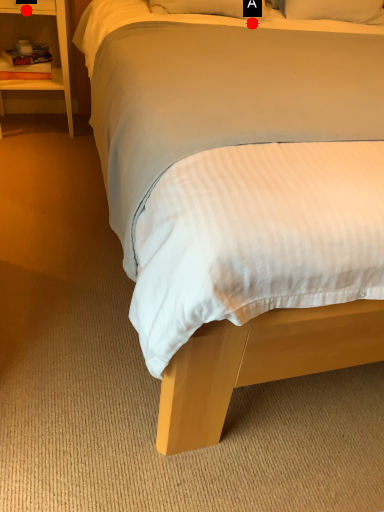
Question: Two points are circled on the image, labeled by A and B beside each circle. Which point appears closest to the camera in this image?

Choices:
 (A) A is closer
 (B) B is closer

Answer: (A)